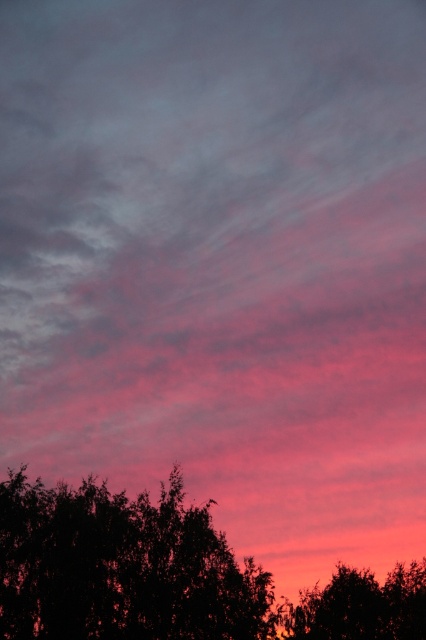
Question: Is silhouette leafy tree at lower center positioned behind silhouette tree at lower right?

Choices:
 (A) no
 (B) yes

Answer: (A)

Question: Is silhouette leafy tree at lower center above silhouette tree at lower right?

Choices:
 (A) yes
 (B) no

Answer: (A)

Question: Can you confirm if silhouette leafy tree at lower center is bigger than silhouette tree at lower right?

Choices:
 (A) no
 (B) yes

Answer: (A)

Question: Which of the following is the closest to the observer?

Choices:
 (A) silhouette tree at lower right
 (B) silhouette leafy tree at lower center

Answer: (B)

Question: Which point is closer to the camera?

Choices:
 (A) (308, 611)
 (B) (115, 509)

Answer: (B)

Question: Which point is closer to the camera taking this photo?

Choices:
 (A) (143, 588)
 (B) (316, 595)

Answer: (A)